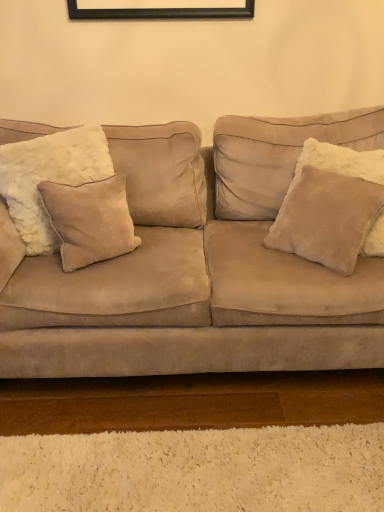
Question: From a real-world perspective, is beige suede pillow at left, which ranks as the second pillow in left-to-right order, beneath suede couch at center?

Choices:
 (A) yes
 (B) no

Answer: (B)

Question: Can we say beige suede pillow at left, which ranks as the second pillow in left-to-right order, lies outside suede couch at center?

Choices:
 (A) yes
 (B) no

Answer: (B)

Question: Is beige suede pillow at left, which ranks as the second pillow in left-to-right order, far from suede couch at center?

Choices:
 (A) no
 (B) yes

Answer: (A)

Question: Considering the relative sizes of beige suede pillow at left, which is the second pillow in right-to-left order, and suede couch at center in the image provided, is beige suede pillow at left, which is the second pillow in right-to-left order, shorter than suede couch at center?

Choices:
 (A) yes
 (B) no

Answer: (A)

Question: From the image's perspective, is beige suede pillow at left, which is the second pillow in right-to-left order, on top of suede couch at center?

Choices:
 (A) yes
 (B) no

Answer: (A)

Question: Does point (236, 181) appear closer or farther from the camera than point (26, 245)?

Choices:
 (A) closer
 (B) farther

Answer: (B)

Question: Considering the positions of suede couch at center and beige suede pillow at left, marked as the 1th pillow in a left-to-right arrangement, in the image, is suede couch at center taller or shorter than beige suede pillow at left, marked as the 1th pillow in a left-to-right arrangement,?

Choices:
 (A) short
 (B) tall

Answer: (B)

Question: In the image, is suede couch at center on the left side or the right side of beige suede pillow at left, the 3th pillow viewed from the right?

Choices:
 (A) right
 (B) left

Answer: (A)

Question: Is suede couch at center in front of or behind beige suede pillow at left, the 3th pillow viewed from the right, in the image?

Choices:
 (A) front
 (B) behind

Answer: (A)

Question: Is point (283, 244) positioned closer to the camera than point (56, 220)?

Choices:
 (A) closer
 (B) farther

Answer: (B)

Question: Is suede pillow at right, the 1th pillow in the right-to-left sequence, in front of or behind beige suede pillow at left, which ranks as the second pillow in left-to-right order, in the image?

Choices:
 (A) behind
 (B) front

Answer: (B)

Question: From the image's perspective, is suede pillow at right, the 1th pillow in the right-to-left sequence, above or below beige suede pillow at left, which is the second pillow in right-to-left order?

Choices:
 (A) below
 (B) above

Answer: (B)

Question: Looking at their shapes, would you say suede pillow at right, positioned as the 3th pillow in left-to-right order, is wider or thinner than beige suede pillow at left, which ranks as the second pillow in left-to-right order?

Choices:
 (A) wide
 (B) thin

Answer: (A)

Question: Considering the positions of point (67, 185) and point (94, 166), is point (67, 185) closer or farther from the camera than point (94, 166)?

Choices:
 (A) farther
 (B) closer

Answer: (B)

Question: Is beige suede pillow at left, which ranks as the second pillow in left-to-right order, wider or thinner than beige suede pillow at left, the 3th pillow viewed from the right?

Choices:
 (A) thin
 (B) wide

Answer: (A)